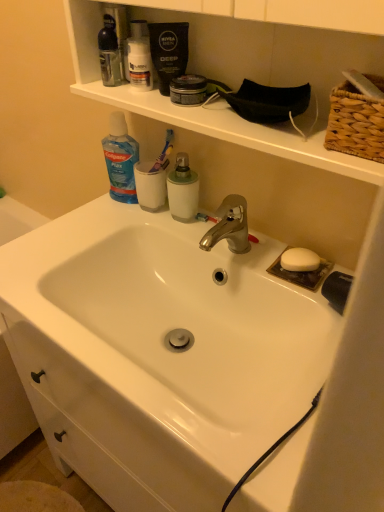
This screenshot has width=384, height=512. Identify the location of free spot to the left of red plastic toothbrush at center, which is the second toothbrush from left to right. (161, 226).